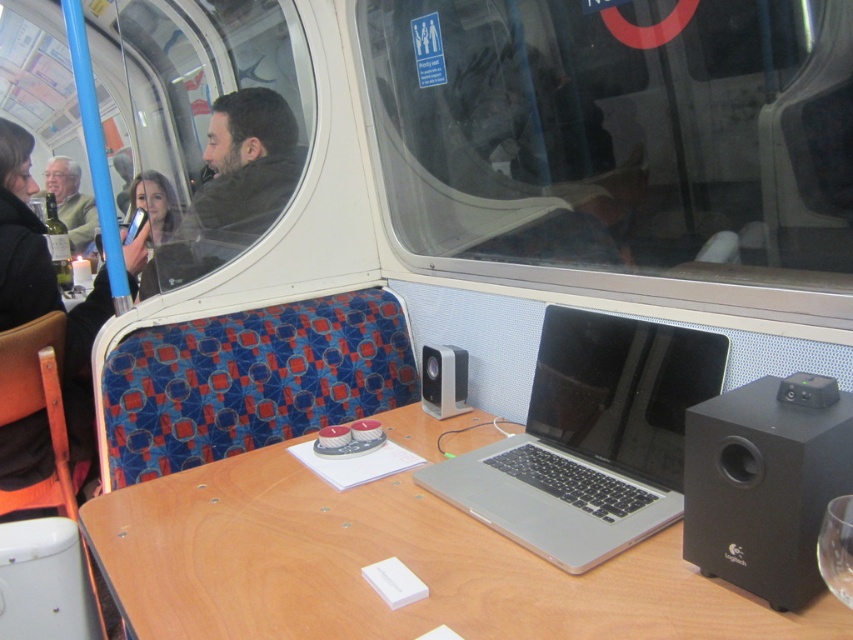
Looking at this image, what is the object located at the coordinates point (x=622, y=145) in the image?

The object located at point (x=622, y=145) is the transparent glass window at center.

You are organizing items in a train carriage. You have a wooden table at center and a dark brown leather jacket at upper left. Which object takes up more space in the scene?

The dark brown leather jacket at upper left takes up more space in the scene because it is larger than the wooden table at center.